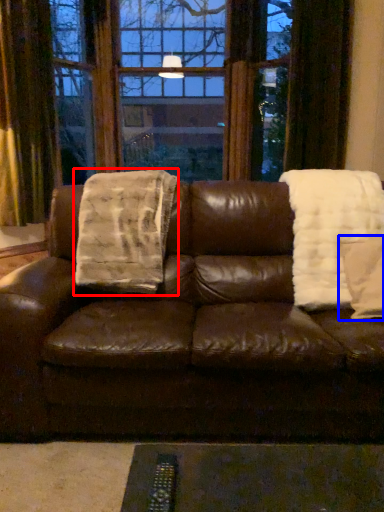
Question: Which object appears farthest to the camera in this image, blanket (highlighted by a red box) or throw pillow (highlighted by a blue box)?

Choices:
 (A) blanket
 (B) throw pillow

Answer: (A)